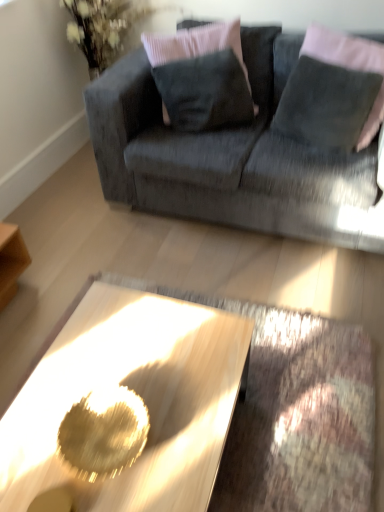
Find the location of a particular element. This screenshot has width=384, height=512. vacant region in front of velvet gray couch at upper center is located at coordinates (260, 313).